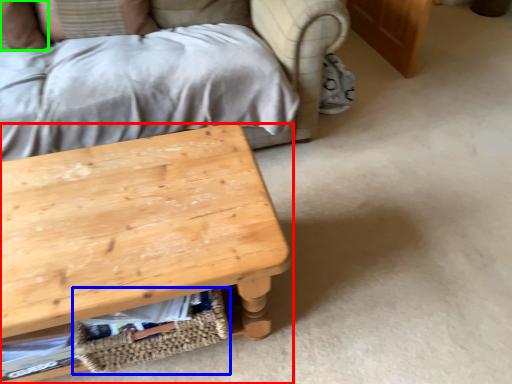
Question: Which is nearer to the table (highlighted by a red box)? basket (highlighted by a blue box) or pillow (highlighted by a green box).

Choices:
 (A) basket
 (B) pillow

Answer: (A)